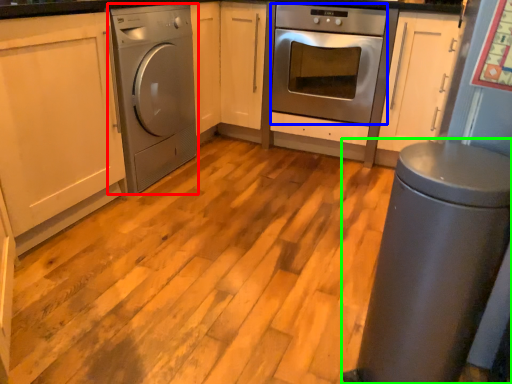
Question: Estimate the real-world distances between objects in this image. Which object is farther from home appliance (highlighted by a red box), oven (highlighted by a blue box) or gray (highlighted by a green box)?

Choices:
 (A) oven
 (B) gray

Answer: (B)